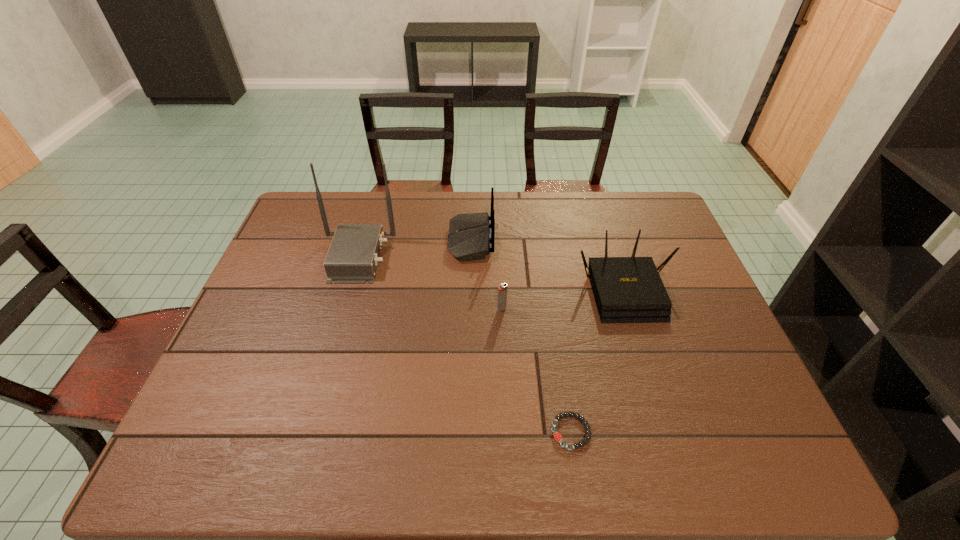
Locate an element on the screen. blank space located 0.150m on the back of the tallest object to connect cables is located at coordinates (441, 256).

What are the coordinates of `vacant space located on the back of the second shortest router` in the screenshot? It's located at (548, 240).

Find the location of `vacant area situated on the left of the shortest router`. vacant area situated on the left of the shortest router is located at coordinates (468, 289).

Identify the location of free location located on the right of the second shortest object. (648, 309).

The height and width of the screenshot is (540, 960). Identify the location of vacant space located 0.290m on the left of the nearest object. (421, 432).

Find the location of a particular element. The width and height of the screenshot is (960, 540). object positioned at the near edge is located at coordinates (557, 436).

Find the location of a particular element. This screenshot has width=960, height=540. object that is at the left edge is located at coordinates (353, 256).

Find the location of a particular element. This screenshot has height=540, width=960. object present at the right edge is located at coordinates (626, 289).

Find the location of a particular element. The width and height of the screenshot is (960, 540). object located at the far left corner is located at coordinates (353, 256).

Image resolution: width=960 pixels, height=540 pixels. I want to click on vacant space at the far edge of the desktop, so click(600, 211).